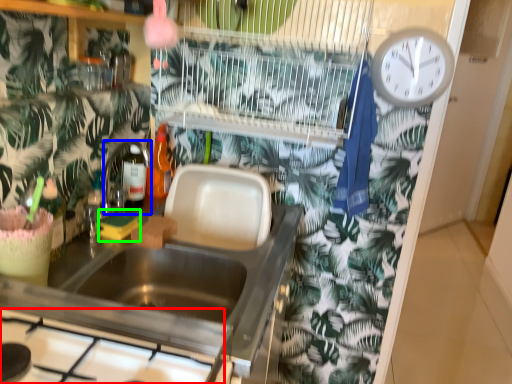
Question: Based on their relative distances, which object is farther from gas stove (highlighted by a red box)? Choose from faucet (highlighted by a blue box) and food (highlighted by a green box).

Choices:
 (A) faucet
 (B) food

Answer: (A)